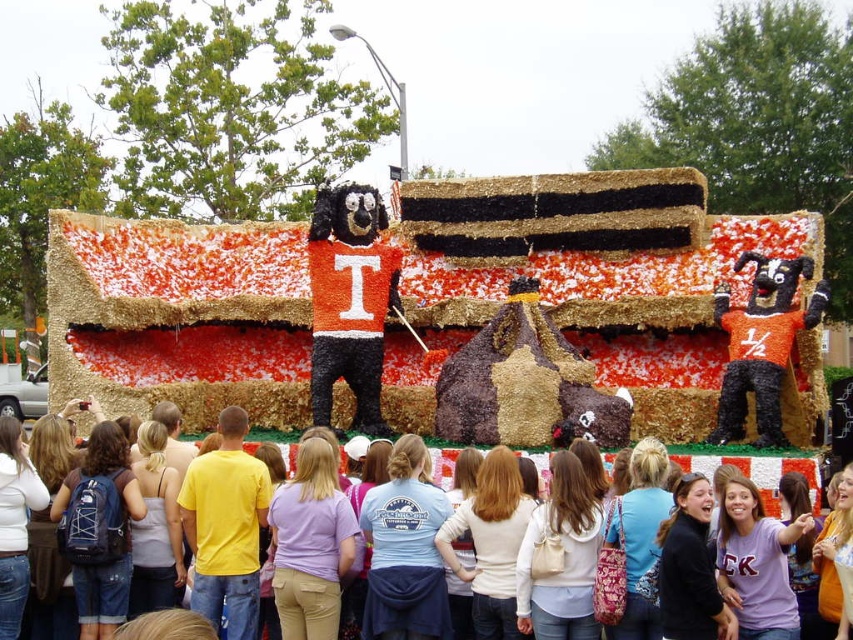
Question: Which of the following is the closest to the observer?

Choices:
 (A) (537, 461)
 (B) (258, 480)

Answer: (B)

Question: Which object appears farthest from the camera in this image?

Choices:
 (A) yellow t-shirt at center
 (B) light blue t-shirt at center

Answer: (B)

Question: Is yellow t-shirt at center smaller than light blue t-shirt at center?

Choices:
 (A) yes
 (B) no

Answer: (A)

Question: Does yellow t-shirt at center appear under light blue t-shirt at center?

Choices:
 (A) no
 (B) yes

Answer: (B)

Question: Can you confirm if yellow t-shirt at center is smaller than light blue t-shirt at center?

Choices:
 (A) yes
 (B) no

Answer: (A)

Question: Among these points, which one is nearest to the camera?

Choices:
 (A) (442, 465)
 (B) (190, 499)

Answer: (B)